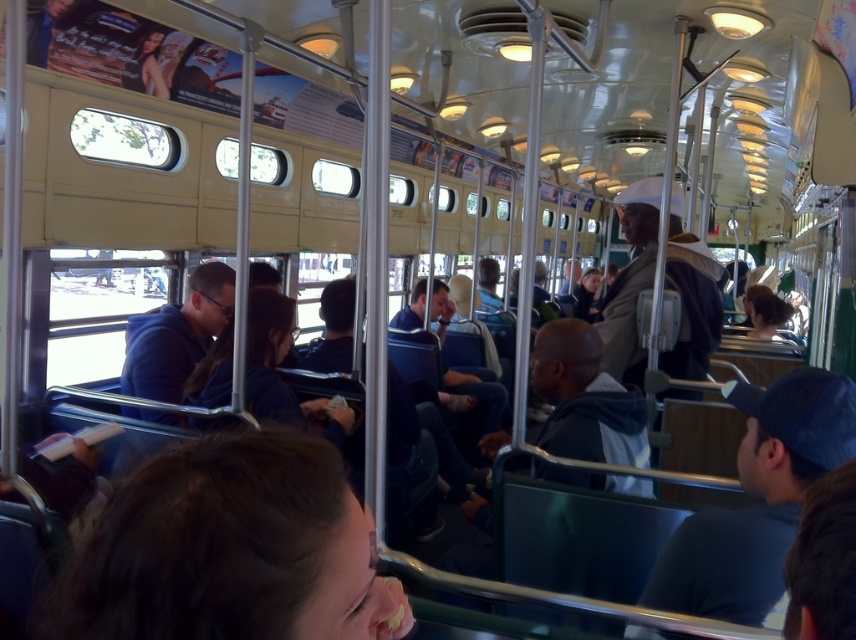
Measure the distance from blue fabric cap at right to brown matte hard hat at center.

blue fabric cap at right and brown matte hard hat at center are 5.30 feet apart from each other.

This screenshot has height=640, width=856. What do you see at coordinates (759, 497) in the screenshot?
I see `blue fabric cap at right` at bounding box center [759, 497].

The width and height of the screenshot is (856, 640). In order to click on blue fabric cap at right in this screenshot , I will do `click(759, 497)`.

Identify the location of dark brown hair at lower center. The width and height of the screenshot is (856, 640). (229, 548).

Is the position of dark brown hair at lower center more distant than that of blue fabric cap at right?

No.

Describe the element at coordinates (229, 548) in the screenshot. I see `dark brown hair at lower center` at that location.

Locate an element on the screen. dark brown hair at lower center is located at coordinates (229, 548).

Can you confirm if dark brown hair at lower center is wider than brown matte hard hat at center?

No.

Which is below, dark brown hair at lower center or brown matte hard hat at center?

Positioned lower is dark brown hair at lower center.

I want to click on dark brown hair at lower center, so click(x=229, y=548).

Locate an element on the screen. The width and height of the screenshot is (856, 640). dark brown hair at lower center is located at coordinates (229, 548).